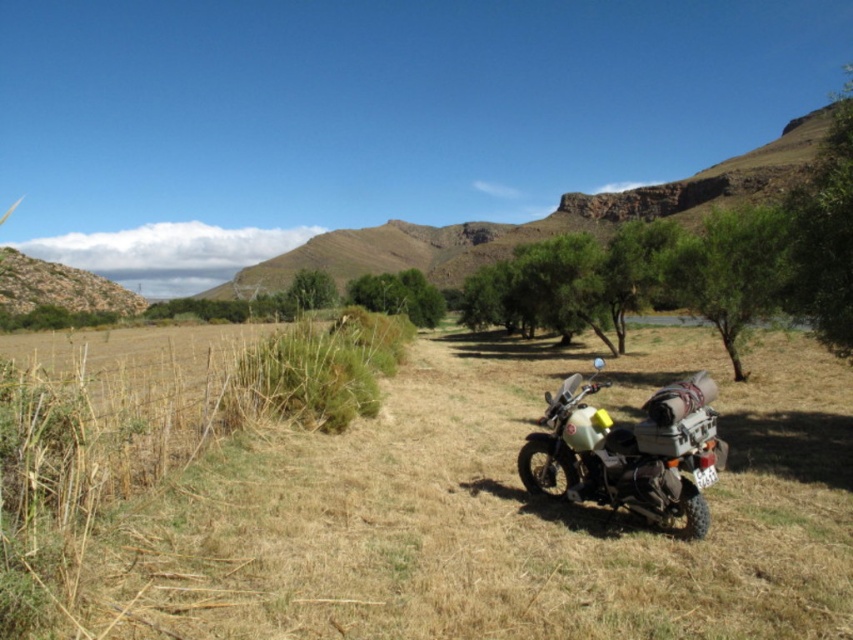
You are standing at the center of the image and want to reach the dry grass at lower center. According to the coordinates provided, in which direction should you move from your current position?

The dry grass at lower center is located at point [495,515], which means you should move downward and to the right from the center to reach it.

Looking at this image, you are standing at the starting point of the dirt path in the foreground. There are two points marked in the image, point A at coordinates point A is point (x=601, y=627) and point B at coordinates point B is point (x=671, y=289). Which point is closer to you?

Point A at coordinates point A is point (x=601, y=627) is closer to the viewer than point B at coordinates point B is point (x=671, y=289).